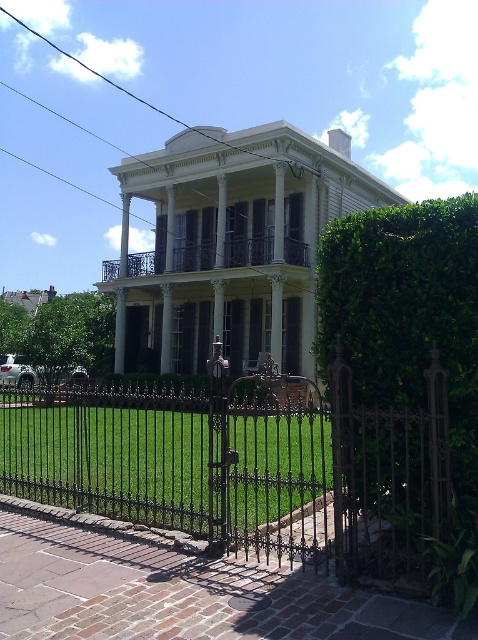
Does green leafy hedge at right appear under white wrought iron porch at center?

Correct, green leafy hedge at right is located below white wrought iron porch at center.

Is green leafy hedge at right bigger than white wrought iron porch at center?

Actually, green leafy hedge at right might be smaller than white wrought iron porch at center.

Between point (375, 369) and point (285, 248), which one is positioned in front?

Point (375, 369) is more forward.

The width and height of the screenshot is (478, 640). What are the coordinates of `green leafy hedge at right` in the screenshot? It's located at (401, 381).

Find the location of a particular element. black wrought iron gate at center is located at coordinates (245, 465).

Between point (434, 532) and point (424, 529), which one is positioned behind?

Point (424, 529)

This screenshot has height=640, width=478. In order to click on black wrought iron gate at center in this screenshot , I will do `click(245, 465)`.

What do you see at coordinates (245, 465) in the screenshot?
I see `black wrought iron gate at center` at bounding box center [245, 465].

Find the location of `black wrought iron gate at center`. black wrought iron gate at center is located at coordinates (245, 465).